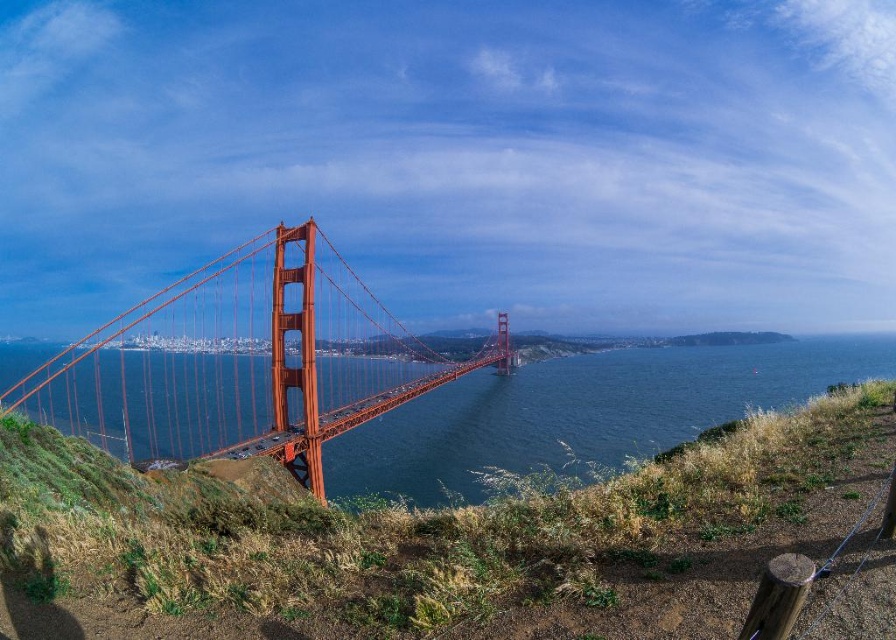
Question: Can you confirm if bright orange bridge at center is wider than transparent blue water at center?

Choices:
 (A) no
 (B) yes

Answer: (A)

Question: Can you confirm if bright orange bridge at center is positioned above transparent blue water at center?

Choices:
 (A) yes
 (B) no

Answer: (A)

Question: Which point is farther to the camera?

Choices:
 (A) bright orange bridge at center
 (B) transparent blue water at center

Answer: (A)

Question: Can you confirm if bright orange bridge at center is thinner than transparent blue water at center?

Choices:
 (A) no
 (B) yes

Answer: (B)